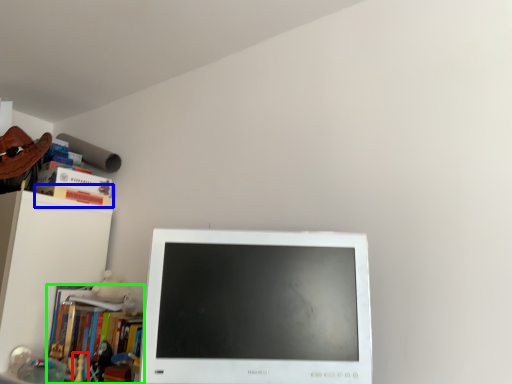
Question: Estimate the real-world distances between objects in this image. Which object is closer to toy (highlighted by a red box), paperback book (highlighted by a blue box) or book (highlighted by a green box)?

Choices:
 (A) paperback book
 (B) book

Answer: (B)